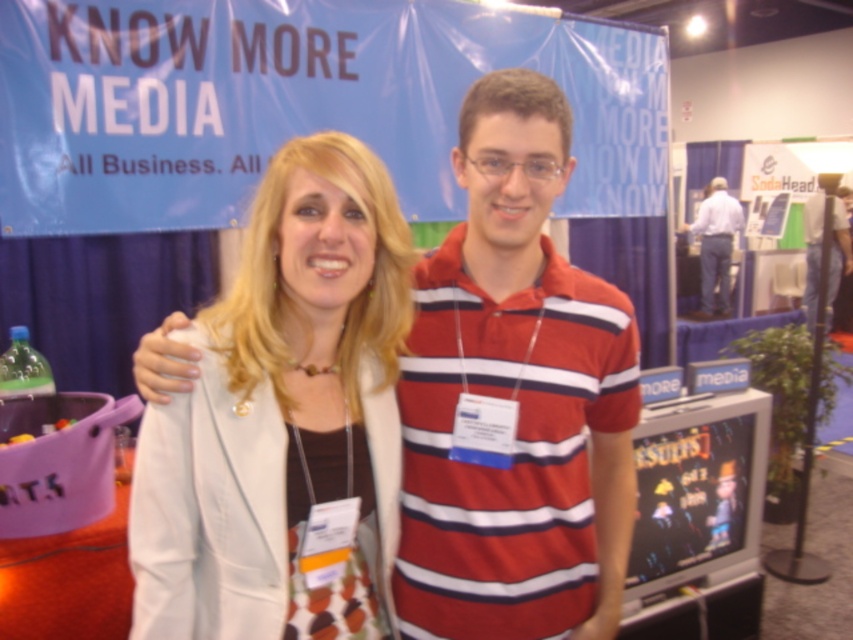
Who is lower down, white fabric jacket at center or striped cotton shirt at center?

white fabric jacket at center

Can you confirm if white fabric jacket at center is bigger than striped cotton shirt at center?

No.

Which is in front, point (387, 182) or point (821, 189)?

Positioned in front is point (387, 182).

The image size is (853, 640). What are the coordinates of `white fabric jacket at center` in the screenshot? It's located at (281, 401).

Can you confirm if white fabric jacket at center is wider than white shirt at center?

No.

Where is `white fabric jacket at center`? This screenshot has height=640, width=853. white fabric jacket at center is located at coordinates (281, 401).

Which is more to the right, striped cotton shirt at center or white shirt at center?

striped cotton shirt at center is more to the right.

Is point (810, 298) farther from camera compared to point (699, 218)?

No.

At what (x,y) coordinates should I click in order to perform the action: click on striped cotton shirt at center. Please return your answer as a coordinate pair (x, y). The width and height of the screenshot is (853, 640). Looking at the image, I should click on (827, 244).